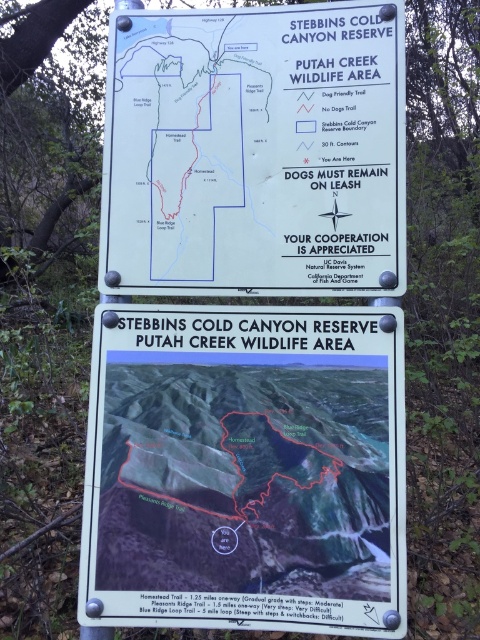
Is white plastic sign at center above white paper sign at upper center?

Actually, white plastic sign at center is below white paper sign at upper center.

Can you confirm if white plastic sign at center is wider than white paper sign at upper center?

Indeed, white plastic sign at center has a greater width compared to white paper sign at upper center.

Identify the location of white plastic sign at center. (245, 468).